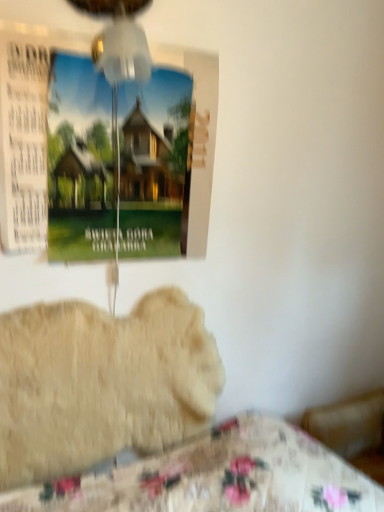
Question: Would you say fluffy beige dog at lower left is outside matte paper poster at upper left?

Choices:
 (A) yes
 (B) no

Answer: (A)

Question: Does fluffy beige dog at lower left have a lesser height compared to matte paper poster at upper left?

Choices:
 (A) yes
 (B) no

Answer: (A)

Question: Can you confirm if fluffy beige dog at lower left is taller than matte paper poster at upper left?

Choices:
 (A) no
 (B) yes

Answer: (A)

Question: Can matte paper poster at upper left be found inside fluffy beige dog at lower left?

Choices:
 (A) yes
 (B) no

Answer: (B)

Question: Is fluffy beige dog at lower left at the left side of matte paper poster at upper left?

Choices:
 (A) yes
 (B) no

Answer: (A)

Question: In the image, is transparent plastic mechanical fan at upper center positioned in front of or behind fluffy beige dog at lower left?

Choices:
 (A) front
 (B) behind

Answer: (A)

Question: From their relative heights in the image, would you say transparent plastic mechanical fan at upper center is taller or shorter than fluffy beige dog at lower left?

Choices:
 (A) tall
 (B) short

Answer: (B)

Question: Is transparent plastic mechanical fan at upper center wider or thinner than fluffy beige dog at lower left?

Choices:
 (A) wide
 (B) thin

Answer: (A)

Question: Which is correct: transparent plastic mechanical fan at upper center is inside fluffy beige dog at lower left, or outside of it?

Choices:
 (A) outside
 (B) inside

Answer: (A)

Question: Considering their positions, is fluffy beige dog at lower left located in front of or behind matte paper poster at upper left?

Choices:
 (A) behind
 (B) front

Answer: (A)

Question: Considering the positions of point coord(157,298) and point coord(82,170), is point coord(157,298) closer or farther from the camera than point coord(82,170)?

Choices:
 (A) farther
 (B) closer

Answer: (A)

Question: Considering the positions of fluffy beige dog at lower left and matte paper poster at upper left in the image, is fluffy beige dog at lower left taller or shorter than matte paper poster at upper left?

Choices:
 (A) short
 (B) tall

Answer: (A)

Question: Is fluffy beige dog at lower left inside or outside of matte paper poster at upper left?

Choices:
 (A) inside
 (B) outside

Answer: (B)

Question: Is point (220, 391) closer or farther from the camera than point (125, 62)?

Choices:
 (A) closer
 (B) farther

Answer: (B)

Question: Looking at their shapes, would you say fluffy beige dog at lower left is wider or thinner than transparent plastic mechanical fan at upper center?

Choices:
 (A) wide
 (B) thin

Answer: (B)